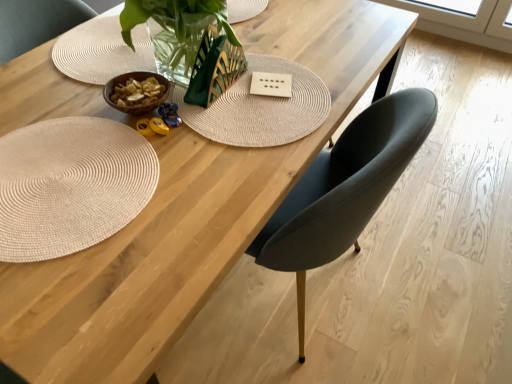
The height and width of the screenshot is (384, 512). In order to click on vacant space behind natural woven mat at lower left in this screenshot , I will do `click(63, 89)`.